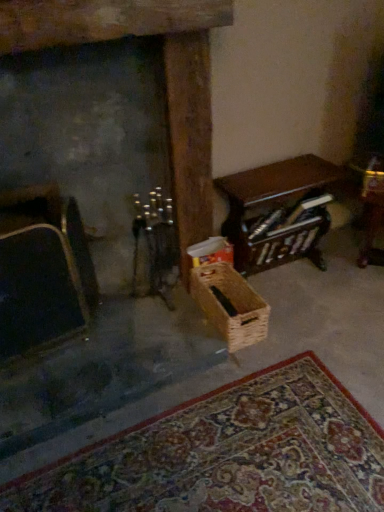
You are a GUI agent. You are given a task and a screenshot of the screen. Output one action in this format:
    pyautogui.click(x=<x>, y=<y>)
    Task: Click on the velvet black armchair at left
    The image size is (384, 512).
    Given the screenshot: What is the action you would take?
    pyautogui.click(x=44, y=281)

Identify the location of woven brown basket at center. (230, 305).

Identify the location of velvet black armchair at left. This screenshot has width=384, height=512. (44, 281).

Considering the sizes of objects dark gray stone fireplace at left and woven brown basket at center in the image provided, who is shorter, dark gray stone fireplace at left or woven brown basket at center?

woven brown basket at center.

Is dark gray stone fireplace at left positioned with its back to woven brown basket at center?

That's not correct — dark gray stone fireplace at left is not looking away from woven brown basket at center.

Which is farther from the camera, (173, 156) or (254, 300)?

The point (254, 300) is farther from the camera.

From the image's perspective, which one is positioned higher, dark gray stone fireplace at left or woven brown basket at center?

dark gray stone fireplace at left appears higher in the image.

Consider the image. In terms of height, does wooden table at right look taller or shorter compared to velvet black armchair at left?

In the image, wooden table at right appears to be shorter than velvet black armchair at left.

From the image's perspective, which is below, wooden table at right or velvet black armchair at left?

velvet black armchair at left is shown below in the image.

Is wooden table at right next to velvet black armchair at left?

wooden table at right and velvet black armchair at left are not in contact.

Find the location of a particular element. table above the velvet black armchair at left (from the image's perspective) is located at coordinates (279, 211).

From a real-world perspective, is velvet black armchair at left below woven brown basket at center?

Actually, velvet black armchair at left is physically above woven brown basket at center in the real world.

Which object is further away from the camera taking this photo, velvet black armchair at left or woven brown basket at center?

woven brown basket at center is further away from the camera.

Based on the photo, how different are the orientations of velvet black armchair at left and woven brown basket at center in degrees?

There is a 0.00165-degree angle between the facing directions of velvet black armchair at left and woven brown basket at center.

Considering the sizes of velvet black armchair at left and woven brown basket at center in the image, is velvet black armchair at left wider or thinner than woven brown basket at center?

Clearly, velvet black armchair at left has less width compared to woven brown basket at center.

Does velvet black armchair at left have a smaller size compared to dark gray stone fireplace at left?

Yes, velvet black armchair at left is smaller than dark gray stone fireplace at left.

Choose the correct answer: Is velvet black armchair at left inside dark gray stone fireplace at left or outside it?

velvet black armchair at left cannot be found inside dark gray stone fireplace at left.

You are a GUI agent. You are given a task and a screenshot of the screen. Output one action in this format:
    pyautogui.click(x=<x>, y=<y>)
    Task: Click on the fireplace in front of the velvet black armchair at left
    
    Given the screenshot: What is the action you would take?
    pyautogui.click(x=165, y=77)

Who is shorter, velvet black armchair at left or dark gray stone fireplace at left?

velvet black armchair at left is shorter.

Where is `basket on the right side of velvet black armchair at left`? The height and width of the screenshot is (512, 384). basket on the right side of velvet black armchair at left is located at coordinates (230, 305).

Is woven brown basket at center positioned with its back to velvet black armchair at left?

No, velvet black armchair at left is not at the back of woven brown basket at center.

How much distance is there between woven brown basket at center and velvet black armchair at left?

woven brown basket at center and velvet black armchair at left are 23.26 inches apart from each other.

Between woven brown basket at center and velvet black armchair at left, which one is positioned in front?

velvet black armchair at left is closer to the camera.

From the image's perspective, is dark gray stone fireplace at left located beneath velvet black armchair at left?

Actually, dark gray stone fireplace at left appears above velvet black armchair at left in the image.

Looking at this image, from a real-world perspective, which is physically above, dark gray stone fireplace at left or velvet black armchair at left?

From a 3D spatial view, dark gray stone fireplace at left is above.

Is there a large distance between dark gray stone fireplace at left and velvet black armchair at left?

No, dark gray stone fireplace at left is not far away from velvet black armchair at left.

I want to click on armchair that appears below the dark gray stone fireplace at left (from a real-world perspective), so tap(44, 281).

From a real-world perspective, relative to dark gray stone fireplace at left, is wooden table at right vertically above or below?

In terms of real-world spatial position, wooden table at right is below dark gray stone fireplace at left.

Considering the sizes of objects wooden table at right and dark gray stone fireplace at left in the image provided, who is bigger, wooden table at right or dark gray stone fireplace at left?

With larger size is dark gray stone fireplace at left.

Is wooden table at right situated inside dark gray stone fireplace at left or outside?

wooden table at right is located beyond the bounds of dark gray stone fireplace at left.

In the image, there is a woven brown basket at center. Identify the location of fireplace above it (from the image's perspective). This screenshot has width=384, height=512. (165, 77).

Where is `armchair lying on the left of wooden table at right`? The width and height of the screenshot is (384, 512). armchair lying on the left of wooden table at right is located at coordinates (44, 281).

When comparing their distances from velvet black armchair at left, does wooden table at right or woven brown basket at center seem further?

wooden table at right.

Based on their spatial positions, is wooden table at right or velvet black armchair at left further from dark gray stone fireplace at left?

velvet black armchair at left is positioned further to the anchor dark gray stone fireplace at left.

Consider the image. Which object lies further to the anchor point velvet black armchair at left, dark gray stone fireplace at left or wooden table at right?

wooden table at right.

Looking at this image, considering their positions, is velvet black armchair at left positioned further to woven brown basket at center than dark gray stone fireplace at left?

Among the two, velvet black armchair at left is located further to woven brown basket at center.

Looking at the image, which one is located closer to woven brown basket at center, dark gray stone fireplace at left or wooden table at right?

wooden table at right is closer to woven brown basket at center.

From the image, which object appears to be nearer to velvet black armchair at left, wooden table at right or dark gray stone fireplace at left?

Among the two, dark gray stone fireplace at left is located nearer to velvet black armchair at left.

Estimate the real-world distances between objects in this image. Which object is further from dark gray stone fireplace at left, wooden table at right or woven brown basket at center?

woven brown basket at center.

When comparing their distances from velvet black armchair at left, does woven brown basket at center or wooden table at right seem further?

wooden table at right is further to velvet black armchair at left.

Image resolution: width=384 pixels, height=512 pixels. Identify the location of basket situated between dark gray stone fireplace at left and wooden table at right from left to right. (230, 305).

Where is `fireplace situated between velvet black armchair at left and wooden table at right from left to right`? The image size is (384, 512). fireplace situated between velvet black armchair at left and wooden table at right from left to right is located at coordinates (165, 77).

The image size is (384, 512). Identify the location of basket located between velvet black armchair at left and wooden table at right in the left-right direction. (230, 305).

Locate an element on the screen. fireplace situated between velvet black armchair at left and woven brown basket at center from left to right is located at coordinates (165, 77).